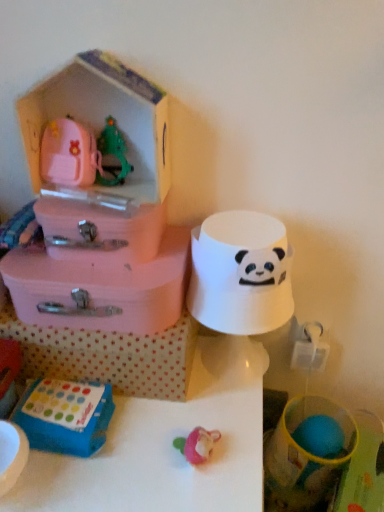
Question: From the image's perspective, is pink plastic storage box at upper left, which appears as the 1th storage box when ordered from the bottom, located above pink plastic toy house at upper left, the fourth storage box when ordered from bottom to top?

Choices:
 (A) yes
 (B) no

Answer: (B)

Question: Considering the relative sizes of pink plastic storage box at upper left, which appears as the 1th storage box when ordered from the bottom, and pink plastic toy house at upper left, arranged as the 1th storage box when viewed from the top, in the image provided, is pink plastic storage box at upper left, which appears as the 1th storage box when ordered from the bottom, smaller than pink plastic toy house at upper left, arranged as the 1th storage box when viewed from the top,?

Choices:
 (A) yes
 (B) no

Answer: (B)

Question: Could you tell me if pink plastic storage box at upper left, the fourth storage box in the top-to-bottom sequence, is facing pink plastic toy house at upper left, the fourth storage box when ordered from bottom to top?

Choices:
 (A) no
 (B) yes

Answer: (A)

Question: Is pink plastic storage box at upper left, which appears as the 1th storage box when ordered from the bottom, positioned with its back to pink plastic toy house at upper left, arranged as the 1th storage box when viewed from the top?

Choices:
 (A) yes
 (B) no

Answer: (B)

Question: Is pink plastic storage box at upper left, which appears as the 1th storage box when ordered from the bottom, at the left side of pink plastic toy house at upper left, arranged as the 1th storage box when viewed from the top?

Choices:
 (A) yes
 (B) no

Answer: (B)

Question: Does pink plastic storage box at upper left, which appears as the 1th storage box when ordered from the bottom, have a larger size compared to pink plastic toy house at upper left, the fourth storage box when ordered from bottom to top?

Choices:
 (A) no
 (B) yes

Answer: (B)

Question: Does pink plastic storage box at upper left, the fourth storage box in the top-to-bottom sequence, turn towards blue plastic toy at lower left, placed as the first toy when sorted from bottom to top?

Choices:
 (A) no
 (B) yes

Answer: (B)

Question: From a real-world perspective, is pink plastic storage box at upper left, which appears as the 1th storage box when ordered from the bottom, located beneath blue plastic toy at lower left, the second toy positioned from the right?

Choices:
 (A) yes
 (B) no

Answer: (B)

Question: Considering the relative sizes of pink plastic storage box at upper left, the fourth storage box in the top-to-bottom sequence, and blue plastic toy at lower left, placed as the first toy when sorted from left to right, in the image provided, is pink plastic storage box at upper left, the fourth storage box in the top-to-bottom sequence, taller than blue plastic toy at lower left, placed as the first toy when sorted from left to right,?

Choices:
 (A) yes
 (B) no

Answer: (A)

Question: Would you consider pink plastic storage box at upper left, the fourth storage box in the top-to-bottom sequence, to be distant from blue plastic toy at lower left, the second toy positioned from the right?

Choices:
 (A) yes
 (B) no

Answer: (B)

Question: Considering the relative sizes of pink plastic storage box at upper left, the fourth storage box in the top-to-bottom sequence, and blue plastic toy at lower left, placed as the first toy when sorted from left to right, in the image provided, is pink plastic storage box at upper left, the fourth storage box in the top-to-bottom sequence, wider than blue plastic toy at lower left, placed as the first toy when sorted from left to right,?

Choices:
 (A) yes
 (B) no

Answer: (A)

Question: Is pink plastic storage box at upper left, which appears as the 1th storage box when ordered from the bottom, in contact with blue plastic toy at lower left, positioned as the 2th toy in top-to-bottom order?

Choices:
 (A) yes
 (B) no

Answer: (A)

Question: Would you say pink plastic suitcase at left, the 2th storage box ordered from the bottom, is a long distance from pink plastic storage box at upper left, the fourth storage box in the top-to-bottom sequence?

Choices:
 (A) yes
 (B) no

Answer: (B)